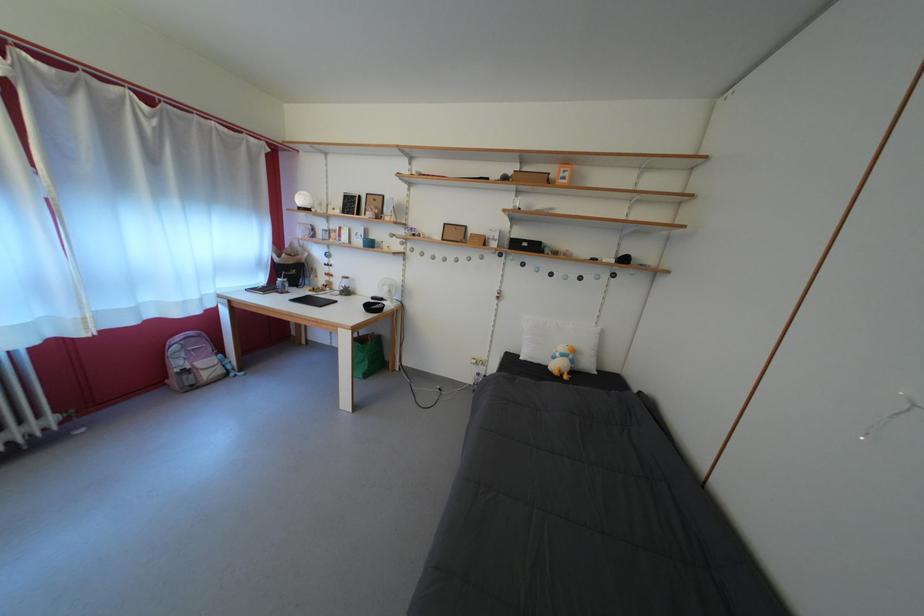
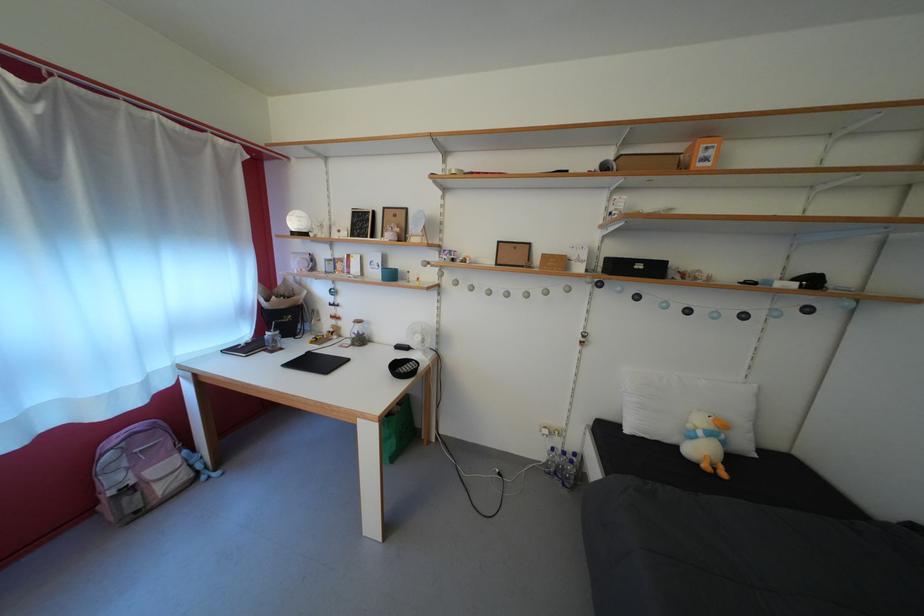
The point at (487, 379) is marked in the first image. Where is the corresponding point in the second image?

(562, 455)